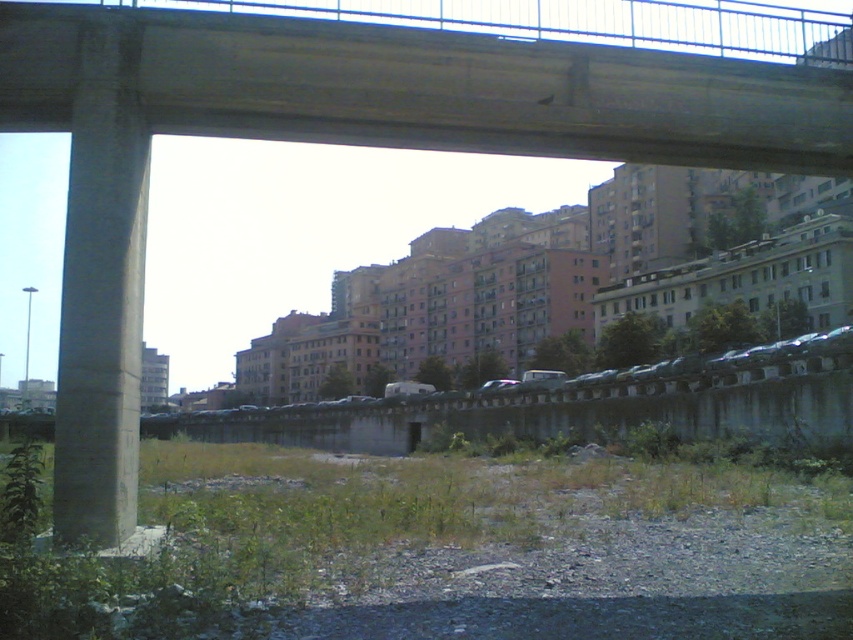
Question: Which of the following is the farthest from the observer?

Choices:
 (A) concrete at upper center
 (B) concrete at left

Answer: (A)

Question: Which point appears farthest from the camera in this image?

Choices:
 (A) (218, 56)
 (B) (100, 465)

Answer: (A)

Question: Does concrete at upper center have a larger size compared to concrete at left?

Choices:
 (A) no
 (B) yes

Answer: (A)

Question: Is concrete at upper center to the right of green leafy weed at lower left from the viewer's perspective?

Choices:
 (A) no
 (B) yes

Answer: (B)

Question: Among these objects, which one is farthest from the camera?

Choices:
 (A) green leafy weed at lower left
 (B) concrete at upper center

Answer: (B)

Question: Is the position of concrete at upper center more distant than that of concrete at left?

Choices:
 (A) no
 (B) yes

Answer: (B)